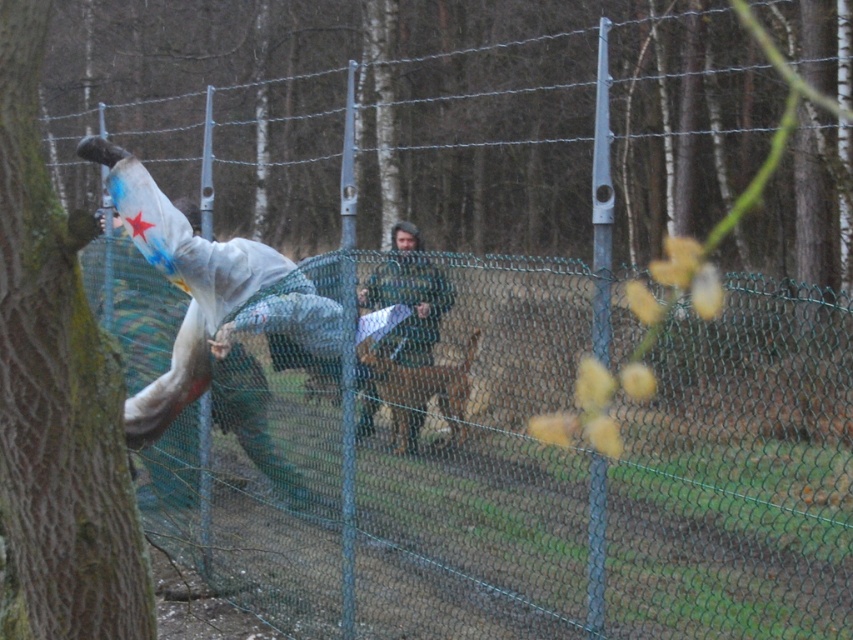
Which is more to the right, green mossy bark tree at left or camouflage fabric jacket at center?

From the viewer's perspective, camouflage fabric jacket at center appears more on the right side.

Describe the element at coordinates (56, 394) in the screenshot. I see `green mossy bark tree at left` at that location.

Find the location of a particular element. The height and width of the screenshot is (640, 853). green mossy bark tree at left is located at coordinates (56, 394).